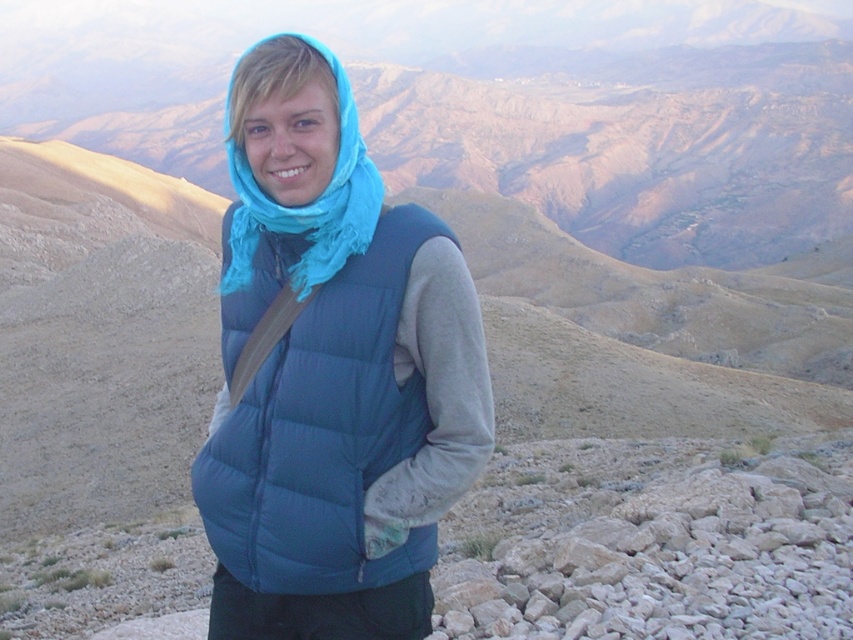
Is matte blue puffer vest at center above turquoise soft scarf at center?

No.

Which of these two, matte blue puffer vest at center or turquoise soft scarf at center, stands shorter?

With less height is matte blue puffer vest at center.

Which is in front, point (364, 486) or point (316, 257)?

Positioned in front is point (316, 257).

At what (x,y) coordinates should I click in order to perform the action: click on matte blue puffer vest at center. Please return your answer as a coordinate pair (x, y). Looking at the image, I should click on (323, 433).